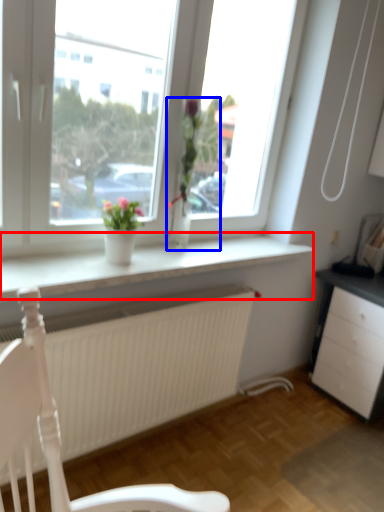
Question: Which point is closer to the camera, window sill (highlighted by a red box) or houseplant (highlighted by a blue box)?

Choices:
 (A) window sill
 (B) houseplant

Answer: (A)